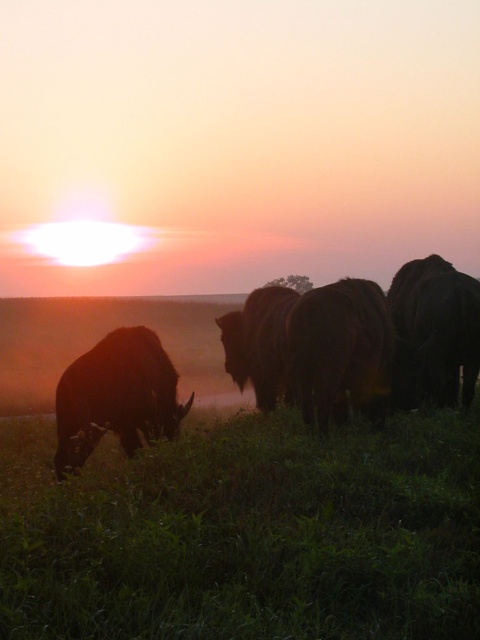
You are a photographer trying to capture the sunset scene. You want to ensure that both the green grassy at lower left and the brown fuzzy bison at center are clearly visible in your photo. Based on their positions, which object will appear closer to the camera in the final image?

The green grassy at lower left will appear closer to the camera because it is positioned in front of the brown fuzzy bison at center.

You are standing at the point with coordinates point (432, 339) and want to walk towards the point with coordinates point (45, 518). Which direction should you head?

Since point (45, 518) is in front of point (432, 339), you should head in the direction towards the point (45, 518) which is in front of your current position.